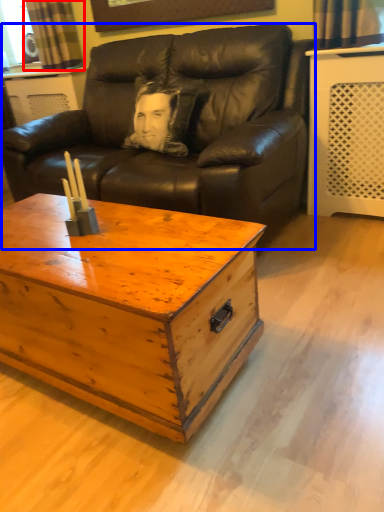
Question: Which of the following is the farthest to the observer, curtain (highlighted by a red box) or studio couch (highlighted by a blue box)?

Choices:
 (A) curtain
 (B) studio couch

Answer: (A)